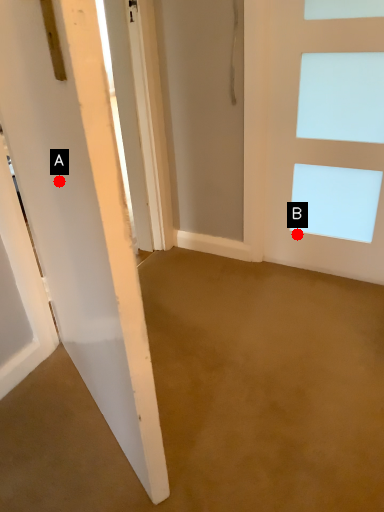
Question: Two points are circled on the image, labeled by A and B beside each circle. Which of the following is the closest to the observer?

Choices:
 (A) A is closer
 (B) B is closer

Answer: (A)